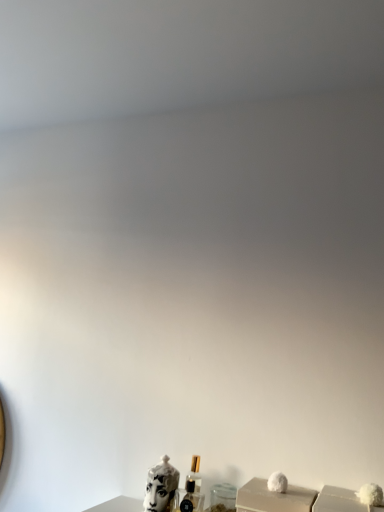
Question: Is white glossy sculpture at lower center taller or shorter than clear glass perfume at center?

Choices:
 (A) tall
 (B) short

Answer: (B)

Question: From a real-world perspective, is white glossy sculpture at lower center physically located above or below clear glass perfume at center?

Choices:
 (A) above
 (B) below

Answer: (B)

Question: Estimate the real-world distances between objects in this image. Which object is closer to the white matte box at lower right?

Choices:
 (A) white glossy sculpture at lower center
 (B) clear glass perfume at center

Answer: (B)

Question: Which of these objects is positioned closest to the clear glass perfume at center?

Choices:
 (A) white glossy sculpture at lower center
 (B) white matte box at lower right

Answer: (A)